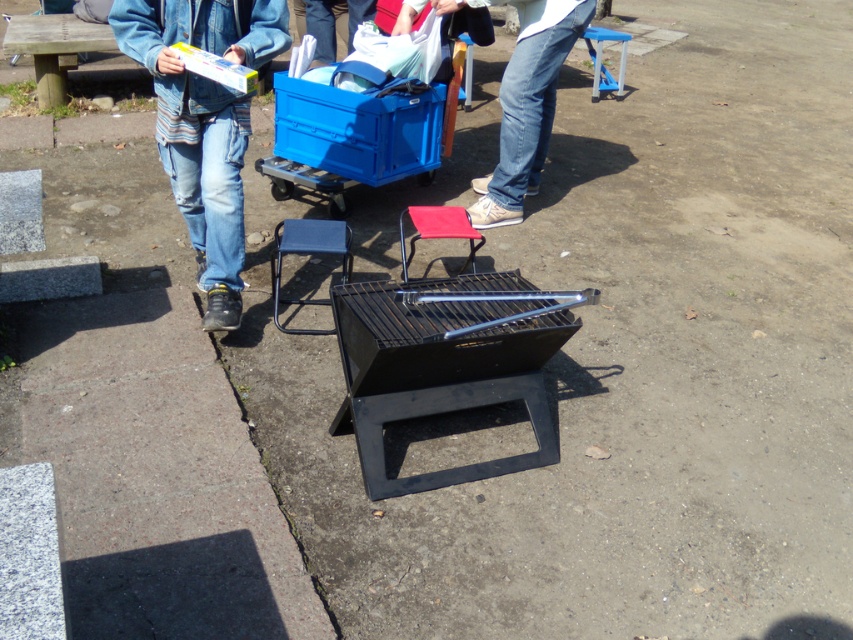
You are planning to set up a picnic and need to place a red fabric stool at center. According to the scene description, where exactly should you place it?

You should place the red fabric stool at center at the coordinates point (x=438, y=228) as specified in the scene description.